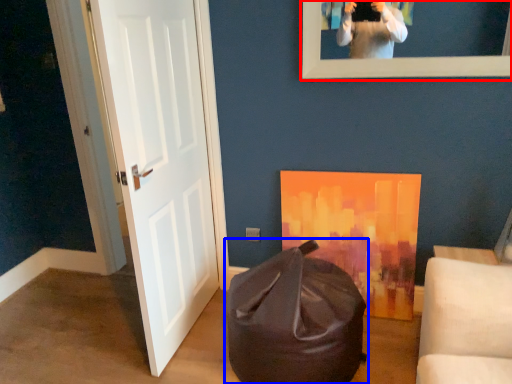
Question: Which of the following is the closest to the observer, picture frame (highlighted by a red box) or bean bag chair (highlighted by a blue box)?

Choices:
 (A) picture frame
 (B) bean bag chair

Answer: (B)